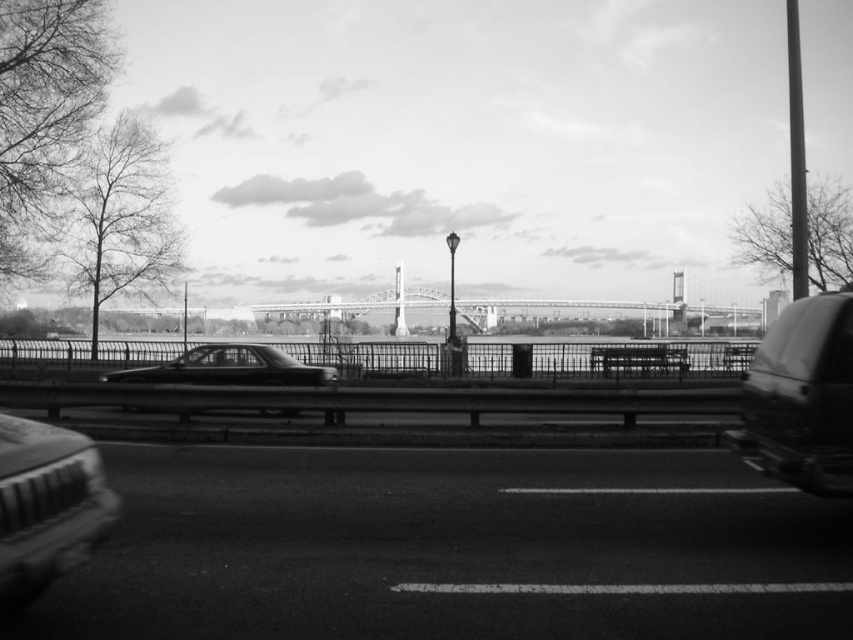
Between metallic gray car at right and shiny black sedan at center, which one appears on the left side from the viewer's perspective?

From the viewer's perspective, shiny black sedan at center appears more on the left side.

Is metallic gray car at right shorter than shiny black sedan at center?

Incorrect, metallic gray car at right's height does not fall short of shiny black sedan at center's.

Which is behind, point (787, 387) or point (273, 371)?

The point (273, 371) is more distant.

Image resolution: width=853 pixels, height=640 pixels. I want to click on metallic gray car at right, so click(801, 397).

Does point (296, 634) come closer to viewer compared to point (216, 362)?

That is True.

Is asphalt road at center thinner than shiny black sedan at center?

Yes, asphalt road at center is thinner than shiny black sedan at center.

Is point (201, 506) positioned behind point (125, 376)?

No, (201, 506) is in front of (125, 376).

The width and height of the screenshot is (853, 640). I want to click on asphalt road at center, so click(451, 548).

Is asphalt road at center taller than metallic silver car at lower left?

No.

Who is more distant from viewer, (563, 477) or (59, 476)?

Point (563, 477)

The height and width of the screenshot is (640, 853). In order to click on asphalt road at center in this screenshot , I will do `click(451, 548)`.